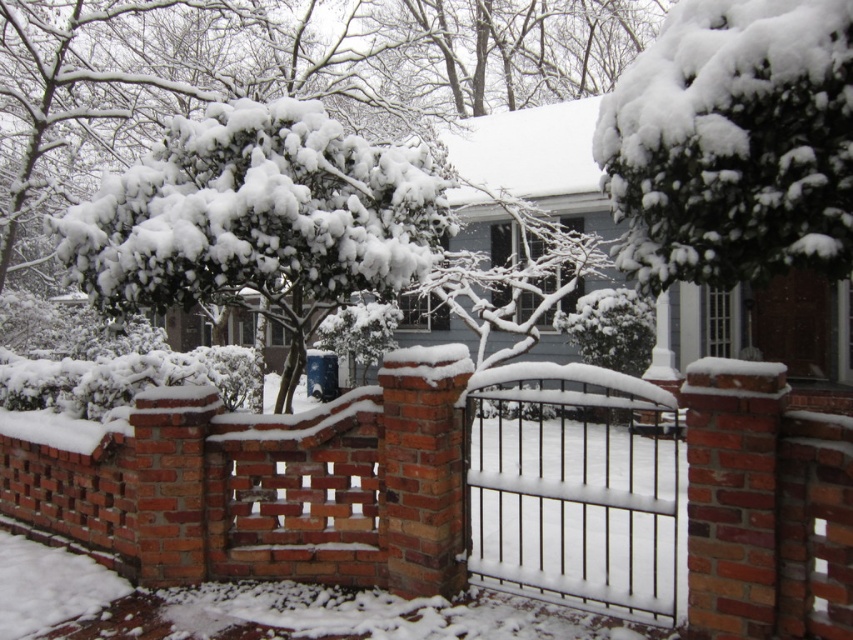
Question: Where is brick wall at center located in relation to green textured bush at upper right in the image?

Choices:
 (A) above
 (B) below

Answer: (B)

Question: Is green textured bush at upper right positioned behind snow-covered branches at center?

Choices:
 (A) no
 (B) yes

Answer: (A)

Question: From the image, what is the correct spatial relationship of green textured bush at upper right in relation to snow-covered branches at center?

Choices:
 (A) left
 (B) right

Answer: (B)

Question: Which is nearer to the black wrought iron gate at center?

Choices:
 (A) green textured bush at upper right
 (B) brick wall at center
 (C) snow-covered branches at center

Answer: (C)

Question: Which object is positioned closest to the brick wall at center?

Choices:
 (A) snow-covered branches at center
 (B) green textured bush at upper right

Answer: (B)

Question: Among these objects, which one is nearest to the camera?

Choices:
 (A) green textured bush at upper right
 (B) black wrought iron gate at center
 (C) brick wall at center
 (D) snow-covered branches at center

Answer: (A)